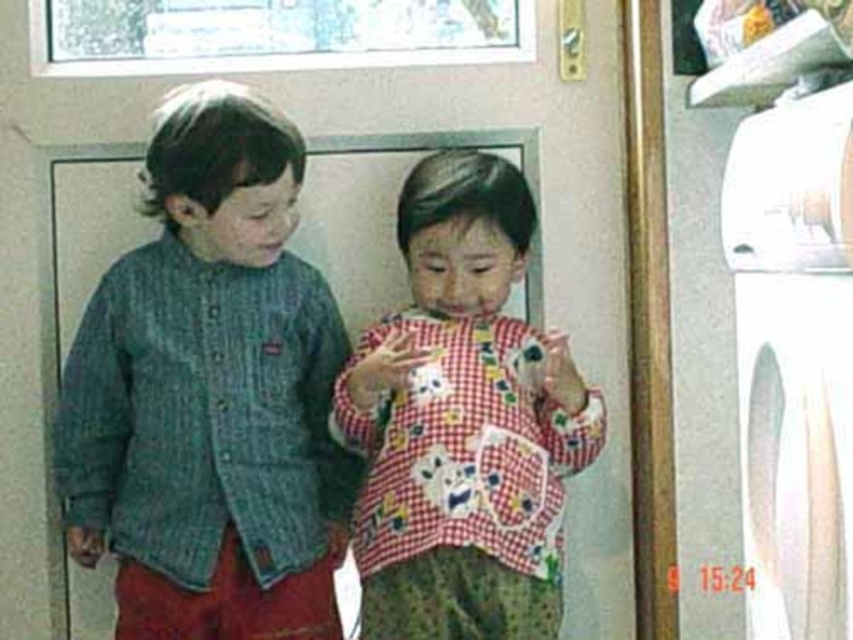
From the picture: You are a parent trying to locate your child wearing the red checkered shirt at center. You know the white plastic washing machine at right is in the laundry room. Which room should you check first?

The red checkered shirt at center is positioned under the white plastic washing machine at right, so the parent should check the laundry room first.

You are helping organize the laundry room. You see the green textured sweater at left and the white plastic washing machine at right. Which object is taller?

The green textured sweater at left is taller than the white plastic washing machine at right.

You are a fashion designer observing two children in an indoor setting. The scene includes a green textured sweater at left and the child on the right wearing a red and white checkered shirt. Based on their positions, which child is closer to the left side of the image?

The child wearing the green textured sweater at left is closer to the left side of the image because the green textured sweater at left is located at point (x=210, y=394), indicating its position near the left edge.